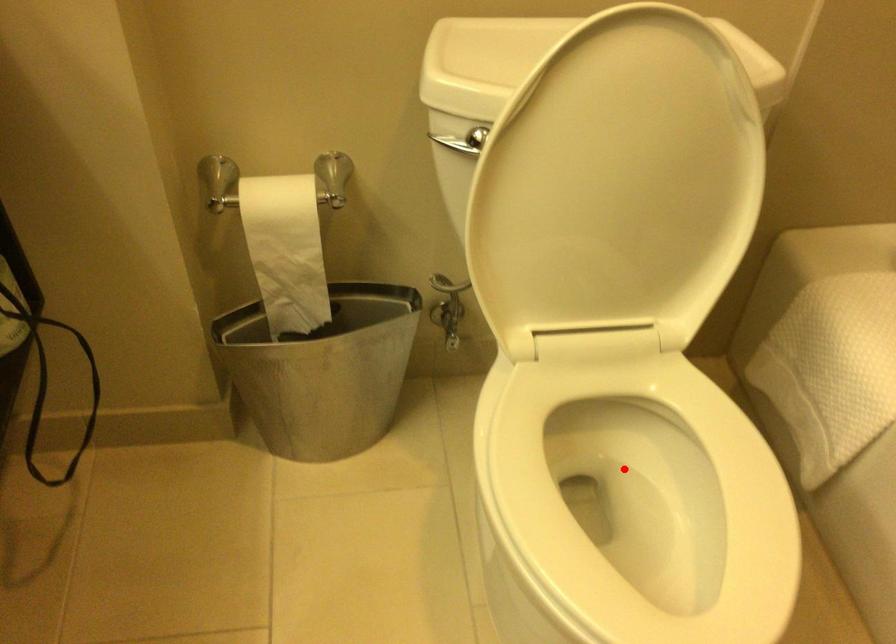
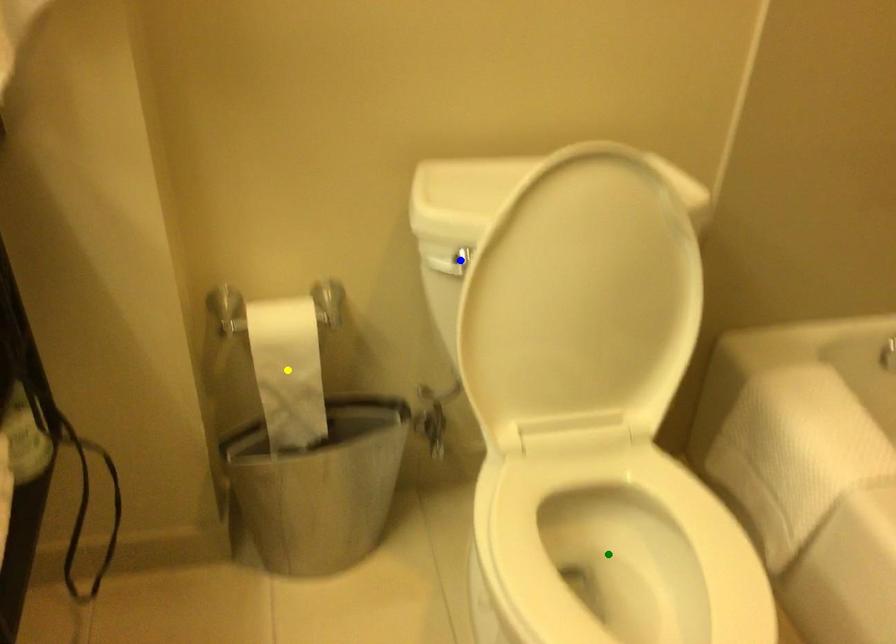
Question: I am providing you with two images of the same scene from different viewpoints. A red point is marked on the first image. You are given multiple points on the second image. Which spot in image 2 lines up with the point in image 1?

Choices:
 (A) yellow point
 (B) green point
 (C) blue point

Answer: (B)